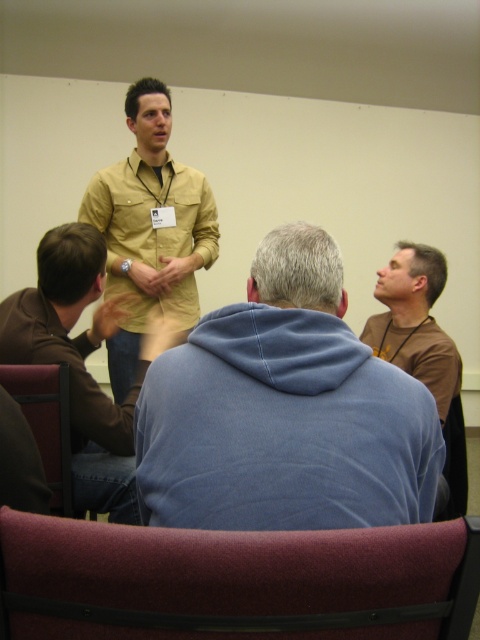
Can you confirm if brown leather jacket at upper left is positioned to the right of maroon fabric chair at lower left?

Indeed, brown leather jacket at upper left is positioned on the right side of maroon fabric chair at lower left.

Between brown leather jacket at upper left and maroon fabric chair at lower left, which one appears on the left side from the viewer's perspective?

Positioned to the left is maroon fabric chair at lower left.

This screenshot has width=480, height=640. In order to click on brown leather jacket at upper left in this screenshot , I will do `click(83, 362)`.

What do you see at coordinates (285, 412) in the screenshot? I see `blue fleece jacket at center` at bounding box center [285, 412].

From the picture: Which is above, blue fleece jacket at center or maroon fabric chair at lower left?

blue fleece jacket at center is higher up.

At what (x,y) coordinates should I click in order to perform the action: click on blue fleece jacket at center. Please return your answer as a coordinate pair (x, y). This screenshot has width=480, height=640. Looking at the image, I should click on (285, 412).

Can you confirm if blue fleece jacket at center is wider than maroon fabric chair at lower center?

No.

Is blue fleece jacket at center bigger than maroon fabric chair at lower center?

Yes, blue fleece jacket at center is bigger than maroon fabric chair at lower center.

Where is `blue fleece jacket at center`? The image size is (480, 640). blue fleece jacket at center is located at coordinates (285, 412).